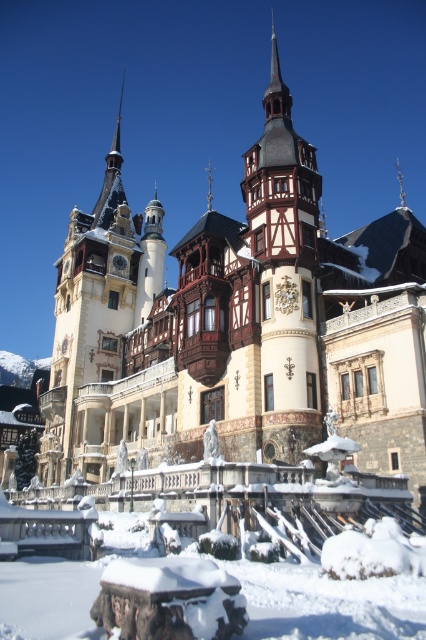
In the scene shown: You are a visitor standing in front of the snow covered castle. You notice two towers, the white painted wood tower at left and the wooden tower at center. Which tower is bigger?

The white painted wood tower at left is larger in size compared to the wooden tower at center.

You are a castle architect planning to install a new communication line between the white painted wood tower at left and the wooden tower at center. The cable can stretch up to 50 meters. Will the cable be sufficient to connect them?

The white painted wood tower at left is 47.59 meters from the wooden tower at center. Since the cable can stretch up to 50 meters, the cable will be sufficient to connect them as 47.59 meters is within the cable length limit.